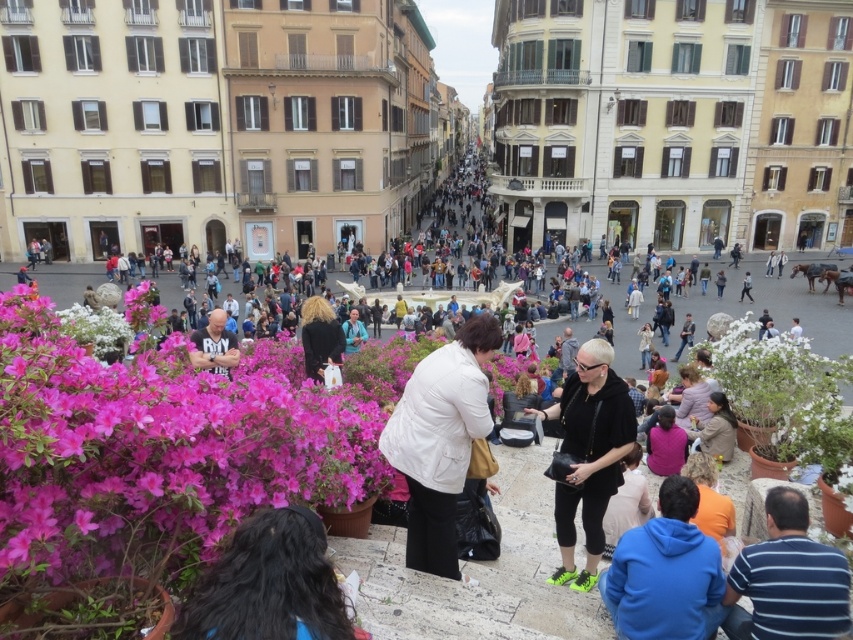
Question: Which point is closer to the camera taking this photo?

Choices:
 (A) (125, 381)
 (B) (337, 326)

Answer: (A)

Question: Considering the real-world distances, which object is closest to the blue fleece jacket at lower right?

Choices:
 (A) black fabric jacket at center
 (B) white matte jacket at center

Answer: (B)

Question: Is blue fleece jacket at lower right in front of black leather jacket at center?

Choices:
 (A) no
 (B) yes

Answer: (B)

Question: Which is nearer to the black leather jacket at center?

Choices:
 (A) blue denim jeans at center
 (B) white matte jacket at center
 (C) blue fleece jacket at lower right
 (D) pink matte flowers at lower left

Answer: (B)

Question: Can you confirm if blue fleece jacket at lower right is smaller than blue denim jeans at center?

Choices:
 (A) no
 (B) yes

Answer: (B)

Question: Is pink matte flowers at lower left smaller than dark brown hair at lower center?

Choices:
 (A) no
 (B) yes

Answer: (A)